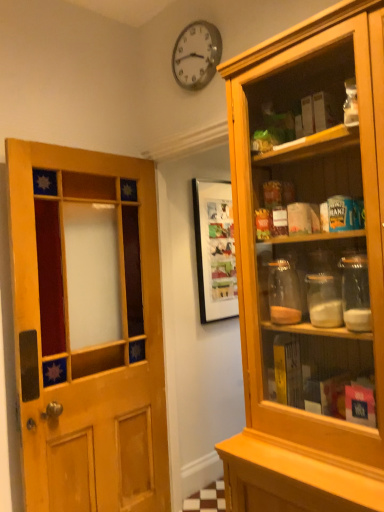
Question: In terms of size, does metallic clock at upper center appear bigger or smaller than wooden door at left?

Choices:
 (A) big
 (B) small

Answer: (B)

Question: In terms of width, does metallic clock at upper center look wider or thinner when compared to wooden door at left?

Choices:
 (A) thin
 (B) wide

Answer: (A)

Question: From a real-world perspective, is metallic clock at upper center physically located above or below wooden door at left?

Choices:
 (A) above
 (B) below

Answer: (A)

Question: Is wooden door at left in front of or behind metallic clock at upper center in the image?

Choices:
 (A) front
 (B) behind

Answer: (A)

Question: Is point (59, 182) positioned closer to the camera than point (198, 76)?

Choices:
 (A) closer
 (B) farther

Answer: (B)

Question: Would you say wooden door at left is to the left or to the right of metallic clock at upper center in the picture?

Choices:
 (A) right
 (B) left

Answer: (B)

Question: Do you think wooden door at left is within metallic clock at upper center, or outside of it?

Choices:
 (A) outside
 (B) inside

Answer: (A)